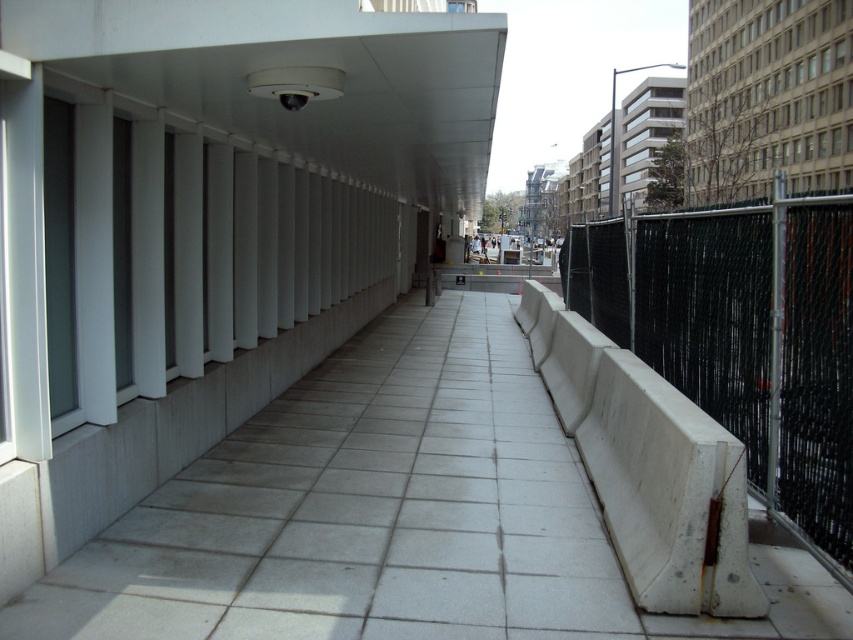
Question: Which of the following is the closest to the observer?

Choices:
 (A) white concrete barrier at right
 (B) black chain-link fence at right

Answer: (A)

Question: Does black chain-link fence at right have a lesser width compared to white concrete barrier at right?

Choices:
 (A) yes
 (B) no

Answer: (A)

Question: Which object appears farthest from the camera in this image?

Choices:
 (A) white concrete barrier at right
 (B) black chain-link fence at right

Answer: (B)

Question: Is black chain-link fence at right thinner than white concrete barrier at right?

Choices:
 (A) no
 (B) yes

Answer: (B)

Question: Can you confirm if black chain-link fence at right is positioned below white concrete barrier at right?

Choices:
 (A) no
 (B) yes

Answer: (A)

Question: Which point is farther from the camera taking this photo?

Choices:
 (A) (657, 477)
 (B) (822, 532)

Answer: (A)